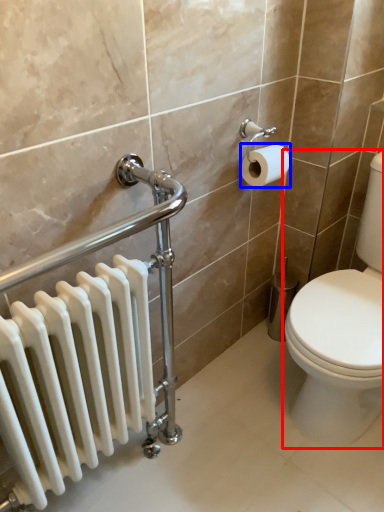
Question: Which object is further to the camera taking this photo, toilet (highlighted by a red box) or toilet paper (highlighted by a blue box)?

Choices:
 (A) toilet
 (B) toilet paper

Answer: (B)